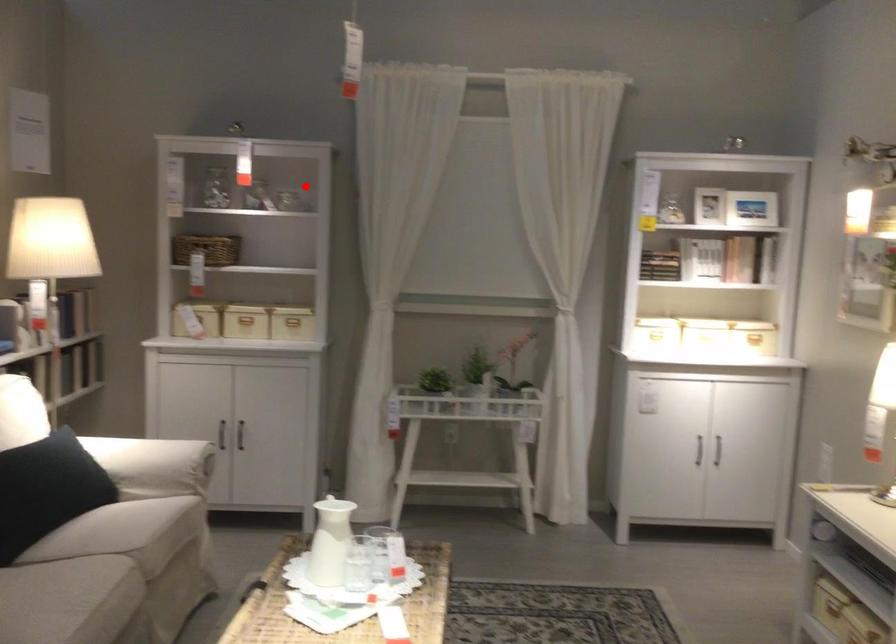
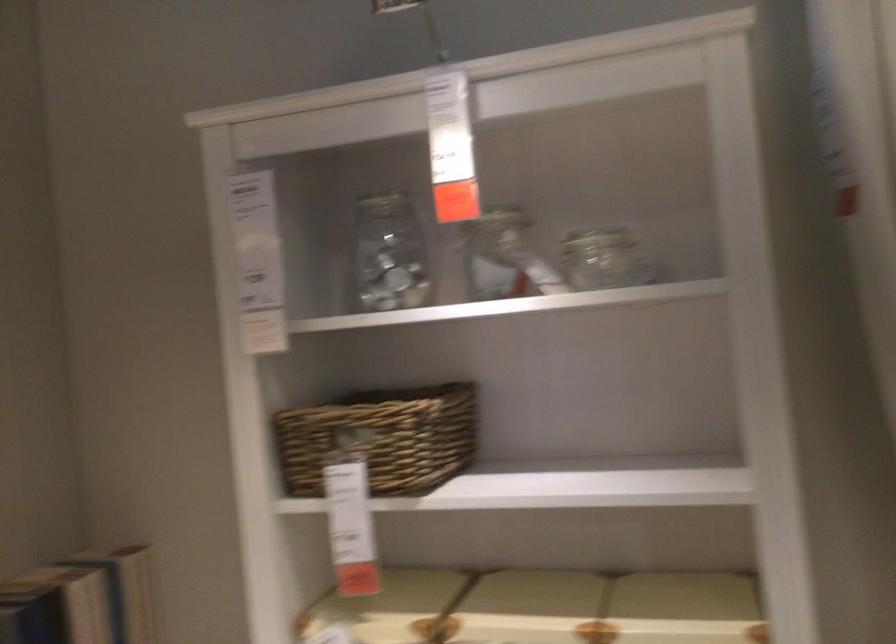
Find the pixel in the second image that matches the highlighted location in the first image.

(597, 238)